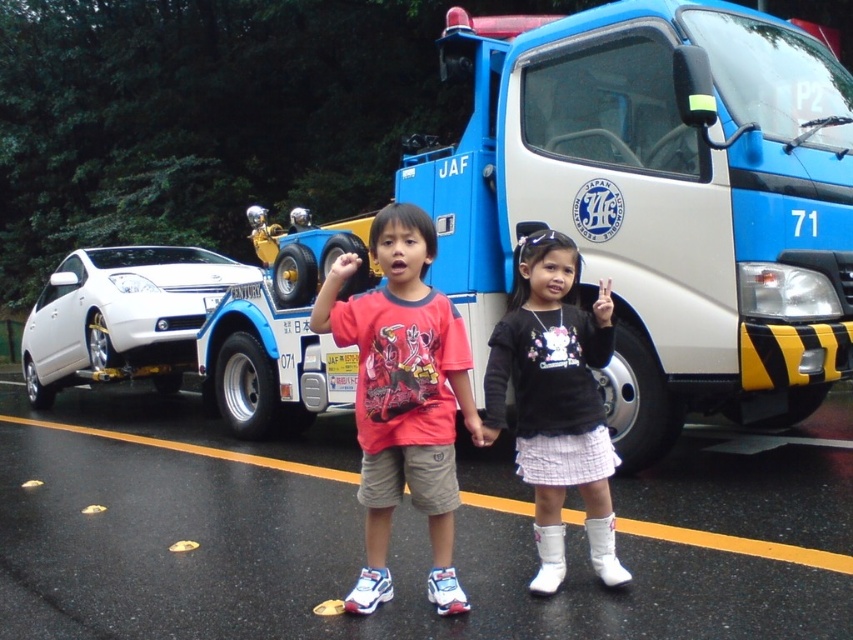
Is blue metallic tow truck at center to the left of white glossy car at left from the viewer's perspective?

No, blue metallic tow truck at center is not to the left of white glossy car at left.

You are a GUI agent. You are given a task and a screenshot of the screen. Output one action in this format:
    pyautogui.click(x=<x>, y=<y>)
    Task: Click on the blue metallic tow truck at center
    
    Given the screenshot: What is the action you would take?
    pyautogui.click(x=656, y=200)

Can you confirm if matte red t-shirt at center is positioned below white matte boots at lower center?

Yes.

Image resolution: width=853 pixels, height=640 pixels. What do you see at coordinates (403, 397) in the screenshot?
I see `matte red t-shirt at center` at bounding box center [403, 397].

Find the location of `matte red t-shirt at center`. matte red t-shirt at center is located at coordinates (403, 397).

Is blue metallic tow truck at center bigger than matte red t-shirt at center?

Yes, blue metallic tow truck at center is bigger than matte red t-shirt at center.

Who is more distant from viewer, [453,154] or [367,497]?

The point [453,154] is more distant.

Where is `blue metallic tow truck at center`? blue metallic tow truck at center is located at coordinates (656, 200).